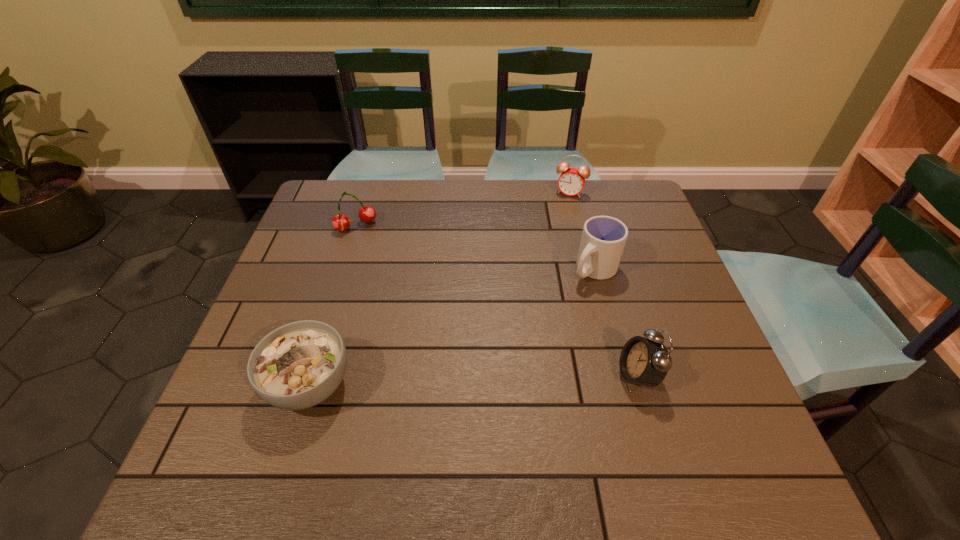
Find the location of `vacant region located 0.270m with the handle on the side of the cup`. vacant region located 0.270m with the handle on the side of the cup is located at coordinates (509, 340).

Identify the location of vacant space located with the handle on the side of the cup. The width and height of the screenshot is (960, 540). (468, 374).

The width and height of the screenshot is (960, 540). Find the location of `free space located on the clock face of the farther alarm clock`. free space located on the clock face of the farther alarm clock is located at coordinates (561, 211).

What are the coordinates of `vacant space located on the clock face of the farther alarm clock` in the screenshot? It's located at (562, 209).

Find the location of a particular element. Image resolution: width=960 pixels, height=540 pixels. vacant area situated on the clock face of the farther alarm clock is located at coordinates (557, 220).

The height and width of the screenshot is (540, 960). What are the coordinates of `vacant space located with stems pointing upwards on the fourth nearest object` in the screenshot? It's located at (399, 300).

You are a GUI agent. You are given a task and a screenshot of the screen. Output one action in this format:
    pyautogui.click(x=<x>, y=<y>)
    Task: Click on the blank area located with stems pointing upwards on the fourth nearest object
    
    Given the screenshot: What is the action you would take?
    pyautogui.click(x=402, y=305)

Find the location of `vacant space positioned with stems pointing upwards on the fourth nearest object`. vacant space positioned with stems pointing upwards on the fourth nearest object is located at coordinates (415, 327).

This screenshot has width=960, height=540. What are the coordinates of `alarm clock situated at the far edge` in the screenshot? It's located at (571, 181).

Where is `cherry at the far edge`? This screenshot has width=960, height=540. cherry at the far edge is located at coordinates (340, 222).